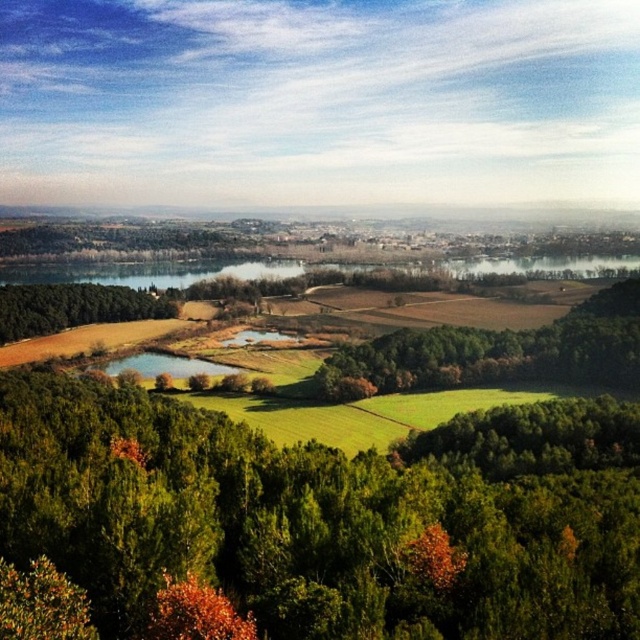
Which is below, green leafy trees at center or green leafy tree at lower left?

green leafy trees at center is below.

In the scene shown: Can you confirm if green leafy trees at center is taller than green leafy tree at lower left?

Incorrect, green leafy trees at center's height is not larger of green leafy tree at lower left's.

Find the location of `green leafy trees at center`. green leafy trees at center is located at coordinates (330, 515).